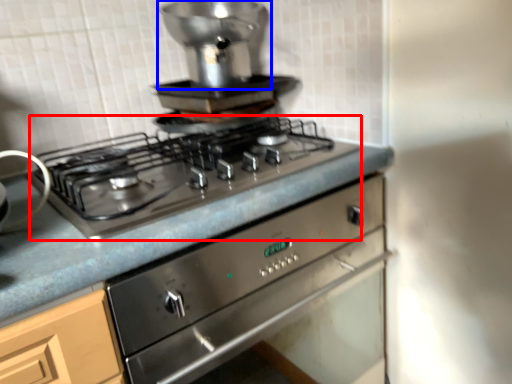
Question: Which of the following is the farthest to the observer, gas stove (highlighted by a red box) or appliance (highlighted by a blue box)?

Choices:
 (A) gas stove
 (B) appliance

Answer: (B)